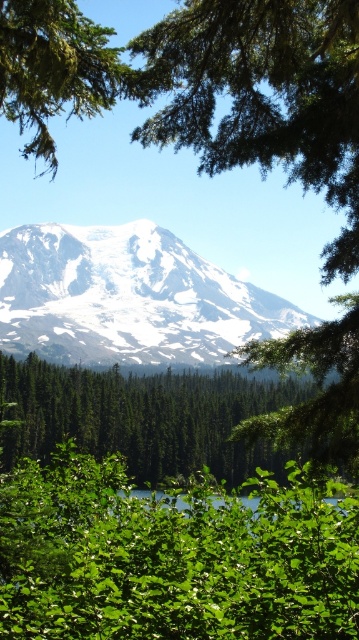
Does white snow-covered mountain at center have a lesser width compared to green leafy tree at center?

In fact, white snow-covered mountain at center might be wider than green leafy tree at center.

Is point (162, 358) positioned in front of point (108, 413)?

Yes, point (162, 358) is in front of point (108, 413).

Where is `white snow-covered mountain at center`? Image resolution: width=359 pixels, height=640 pixels. white snow-covered mountain at center is located at coordinates (127, 298).

Is green leafy tree at center closer to camera compared to green leafy tree at upper left?

No, green leafy tree at center is further to the viewer.

Does point (171, 406) come in front of point (92, 40)?

No, it is behind (92, 40).

Identify the location of green leafy tree at center. Image resolution: width=359 pixels, height=640 pixels. (143, 417).

Consider the image. Who is positioned more to the left, white snow-covered mountain at center or green leafy tree at upper left?

Positioned to the left is green leafy tree at upper left.

Can you confirm if white snow-covered mountain at center is positioned to the right of green leafy tree at upper left?

Correct, you'll find white snow-covered mountain at center to the right of green leafy tree at upper left.

Is point (67, 257) positioned in front of point (44, 131)?

That is False.

Locate an element on the screen. This screenshot has height=640, width=359. white snow-covered mountain at center is located at coordinates [127, 298].